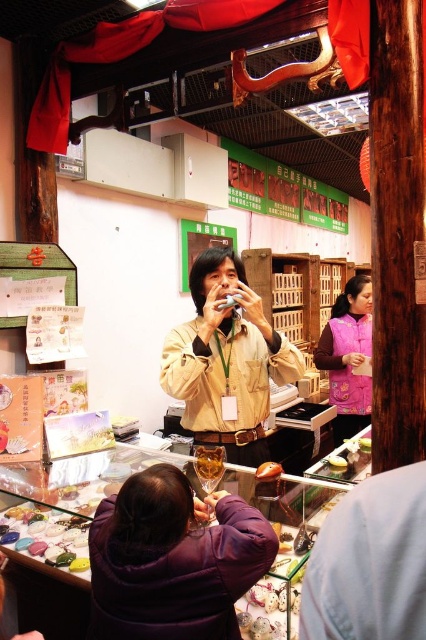
You are a photographer trying to capture both the purple fuzzy coat at lower center and the yellow matte cake at center in a single shot. Given their height difference, which object should you adjust your camera angle to focus on first to ensure both are in frame?

The purple fuzzy coat at lower center is taller than the yellow matte cake at center. To capture both in a single shot, you should lower your camera angle slightly to focus on the yellow matte cake at center first, ensuring the taller purple fuzzy coat at lower center remains visible in the frame.

You are a customer in the shop and want to place a gift card between the pink fleece vest at center and the yellow matte cake at center. The gift card is 10 centimeters long. Can you fit it between them without bending it?

The distance between the pink fleece vest at center and the yellow matte cake at center is 86.89 centimeters. Since the gift card is only 10 centimeters long, there is more than enough space to place it between them without bending it.